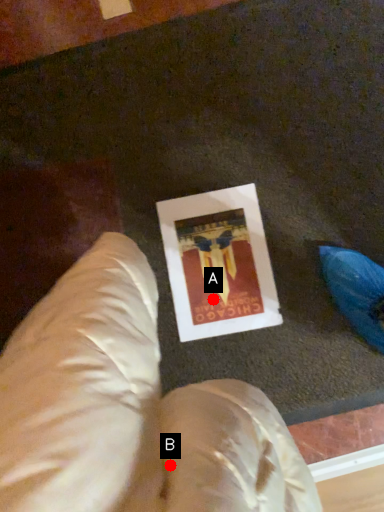
Question: Two points are circled on the image, labeled by A and B beside each circle. Among these points, which one is nearest to the camera?

Choices:
 (A) A is closer
 (B) B is closer

Answer: (B)